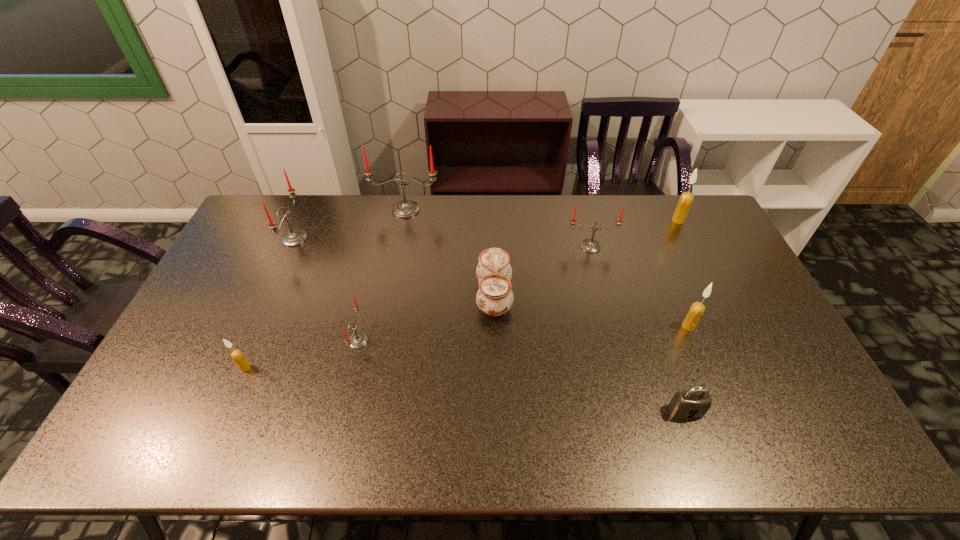
Where is `free region located on the front of the second farthest cream candle`? free region located on the front of the second farthest cream candle is located at coordinates (721, 405).

At what (x,y) coordinates should I click in order to perform the action: click on blank space located 0.220m by the handle of the fifth object from left to right. Please return your answer as a coordinate pair (x, y). The width and height of the screenshot is (960, 540). Looking at the image, I should click on (405, 296).

Identify the location of vacant space situated by the handle of the fifth object from left to right. This screenshot has width=960, height=540. (415, 296).

The width and height of the screenshot is (960, 540). Identify the location of vacant position located 0.210m by the handle of the fifth object from left to right. click(x=408, y=296).

You are a GUI agent. You are given a task and a screenshot of the screen. Output one action in this format:
    pyautogui.click(x=<x>, y=<y>)
    Task: Click on the free space located on the right of the nearest candle
    
    Given the screenshot: What is the action you would take?
    pyautogui.click(x=370, y=368)

Where is `free location located 0.320m on the front-facing side of the smallest red candle`? The width and height of the screenshot is (960, 540). free location located 0.320m on the front-facing side of the smallest red candle is located at coordinates (482, 341).

You are a GUI agent. You are given a task and a screenshot of the screen. Output one action in this format:
    pyautogui.click(x=<x>, y=<y>)
    Task: Click on the free region located at the front of the padlock near the keyhole
    Image resolution: width=960 pixels, height=540 pixels.
    Given the screenshot: What is the action you would take?
    pyautogui.click(x=702, y=457)

Locate an element on the screen. object at the left edge is located at coordinates (295, 237).

You are a GUI agent. You are given a task and a screenshot of the screen. Output one action in this format:
    pyautogui.click(x=<x>, y=<y>)
    Task: Click on the object positioned at the right edge
    
    Given the screenshot: What is the action you would take?
    pyautogui.click(x=686, y=198)

The image size is (960, 540). What are the coordinates of `object that is at the far left corner` in the screenshot? It's located at (295, 237).